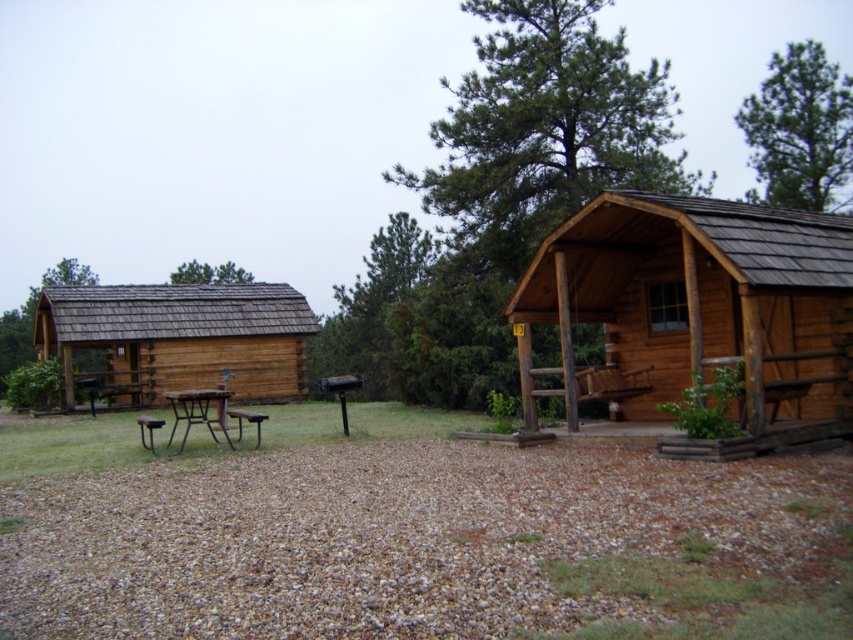
You are standing at point (247, 275) and want to walk to the picnic table in front of the cabin. Is the picnic table located in the direction of point (184, 292) from your current position?

Yes, the picnic table is located in the direction of point (184, 292) from your current position at point (247, 275) because point (184, 292) is in front of point (247, 275).

You are planning to set up a tent in the serene outdoor setting. The tent requires a flat area free of obstacles. Given the presence of the brown gravel at center and the brown wooden hut at left, which location would be more suitable for setting up the tent?

The brown gravel at center is positioned on the right side of brown wooden hut at left. Since the gravel area is flat and free of obstacles, it would be the more suitable location for setting up the tent compared to the area near the brown wooden hut at left.